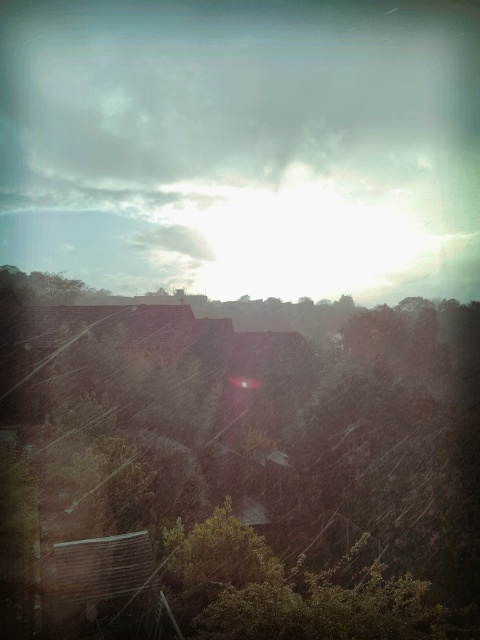
Can you confirm if cloudy sky at upper center is positioned below green leafy tree at center?

Incorrect, cloudy sky at upper center is not positioned below green leafy tree at center.

Is point (190, 285) positioned behind point (367, 515)?

That is True.

You are a GUI agent. You are given a task and a screenshot of the screen. Output one action in this format:
    pyautogui.click(x=<x>, y=<y>)
    Task: Click on the cloudy sky at upper center
    This screenshot has height=640, width=480.
    Given the screenshot: What is the action you would take?
    pyautogui.click(x=243, y=145)